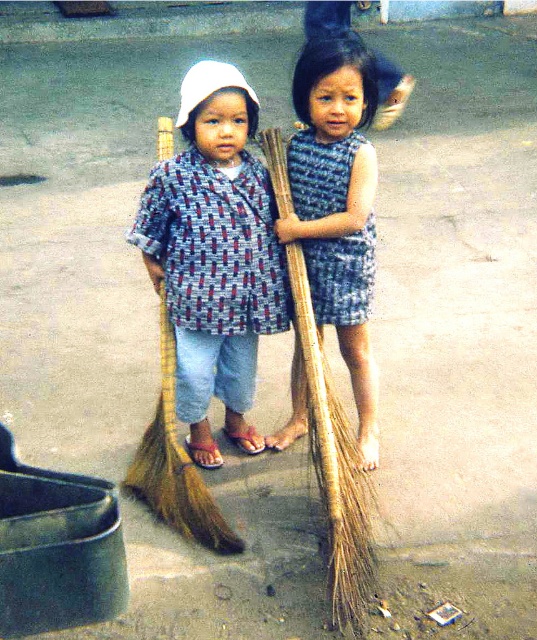
You are a photographer trying to capture both children in a single frame. The camera you have can only focus on objects within a 2.5 meter range. Given that the two children are wearing the matte blue and red checkered shirt at center, will you be able to fit both into focus?

The two children wearing the matte blue and red checkered shirt at center are 2.42 meters apart. Since the camera can focus within a 2.5 meter range, they are within the required distance, so yes, both can be in focus.

You are a photographer trying to capture both the matte blue and red checkered shirt at center and the blue textured dress at center in a single frame. Since you want both subjects to be clearly visible, which clothing item should you focus on first to ensure proper focus?

The matte blue and red checkered shirt at center has a lesser height compared to blue textured dress at center, so you should focus on the blue textured dress at center first because it is taller and more likely to be in focus if the camera is set to auto focus on the nearest subject.